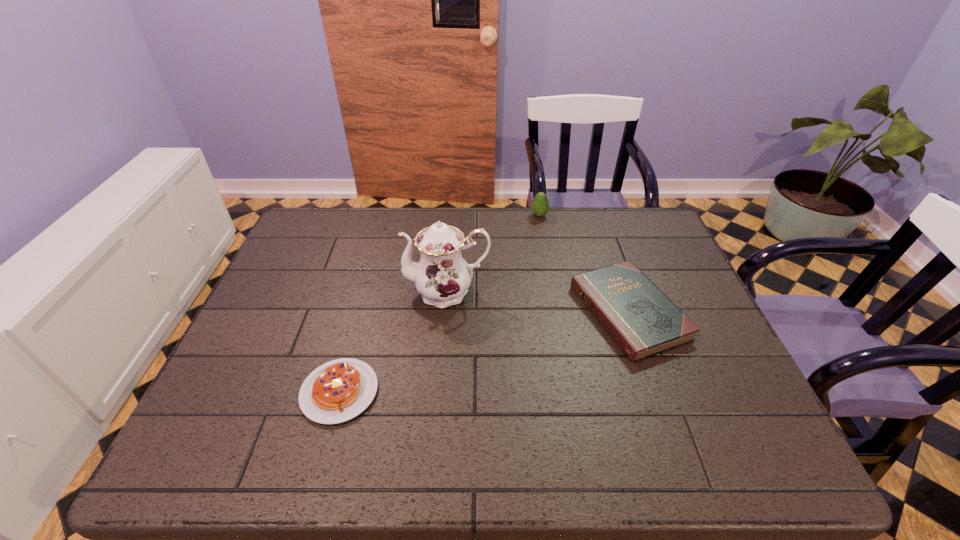
You are a GUI agent. You are given a task and a screenshot of the screen. Output one action in this format:
    pyautogui.click(x=<x>, y=<y>)
    Task: Click on the chinaware
    
    Given the screenshot: What is the action you would take?
    pyautogui.click(x=442, y=277)

At what (x,y) coordinates should I click in order to perform the action: click on the third object from right to left. Please return your answer as a coordinate pair (x, y). The image size is (960, 540). Looking at the image, I should click on (442, 277).

Find the location of a particular element. The height and width of the screenshot is (540, 960). avocado is located at coordinates (540, 205).

Image resolution: width=960 pixels, height=540 pixels. In order to click on the third object from left to right in this screenshot , I will do `click(540, 205)`.

Locate an element on the screen. Bible is located at coordinates (638, 316).

The image size is (960, 540). Find the location of `the leftmost object`. the leftmost object is located at coordinates (337, 391).

What are the coordinates of `the shortest object` in the screenshot? It's located at (337, 391).

Find the location of a particular element. free space located on the left of the tallest object is located at coordinates (x=306, y=292).

You are a GUI agent. You are given a task and a screenshot of the screen. Output one action in this format:
    pyautogui.click(x=<x>, y=<y>)
    Task: Click on the vacant space situated on the front of the farthest object
    The height and width of the screenshot is (540, 960).
    Given the screenshot: What is the action you would take?
    pyautogui.click(x=551, y=284)

Where is `free point located 0.300m on the back of the rightmost object`? The image size is (960, 540). free point located 0.300m on the back of the rightmost object is located at coordinates (594, 213).